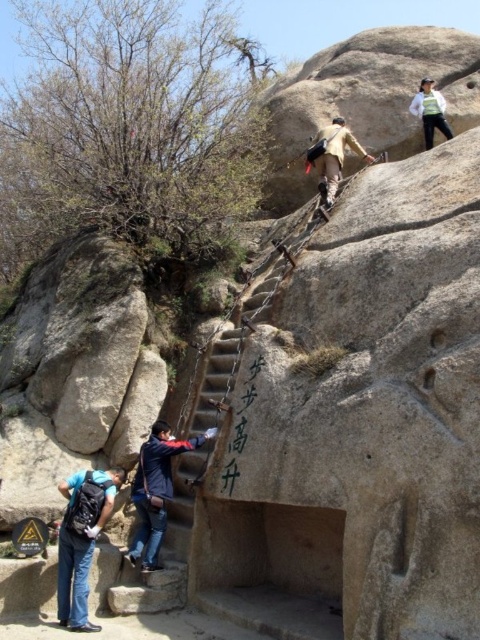
Can you confirm if matte black backpack at lower left is shorter than dark blue jacket at center?

Yes.

Is matte black backpack at lower left thinner than dark blue jacket at center?

Yes.

Which is in front, point (79, 499) or point (202, 435)?

Point (79, 499) is in front.

You are a GUI agent. You are given a task and a screenshot of the screen. Output one action in this format:
    pyautogui.click(x=<x>, y=<y>)
    Task: Click on the matte black backpack at lower left
    Image resolution: width=480 pixels, height=640 pixels.
    Given the screenshot: What is the action you would take?
    pyautogui.click(x=82, y=540)

Can you confirm if dark blue jacket at center is positioned above white matte jacket at upper right?

No.

The image size is (480, 640). Identify the location of dark blue jacket at center. coord(156,490).

Based on the photo, can you confirm if matte black backpack at lower left is positioned to the left of white matte jacket at upper right?

Yes, matte black backpack at lower left is to the left of white matte jacket at upper right.

Which of these two, matte black backpack at lower left or white matte jacket at upper right, stands taller?

With more height is matte black backpack at lower left.

Identify the location of matte black backpack at lower left. (82, 540).

Identify the location of matte black backpack at lower left. (82, 540).